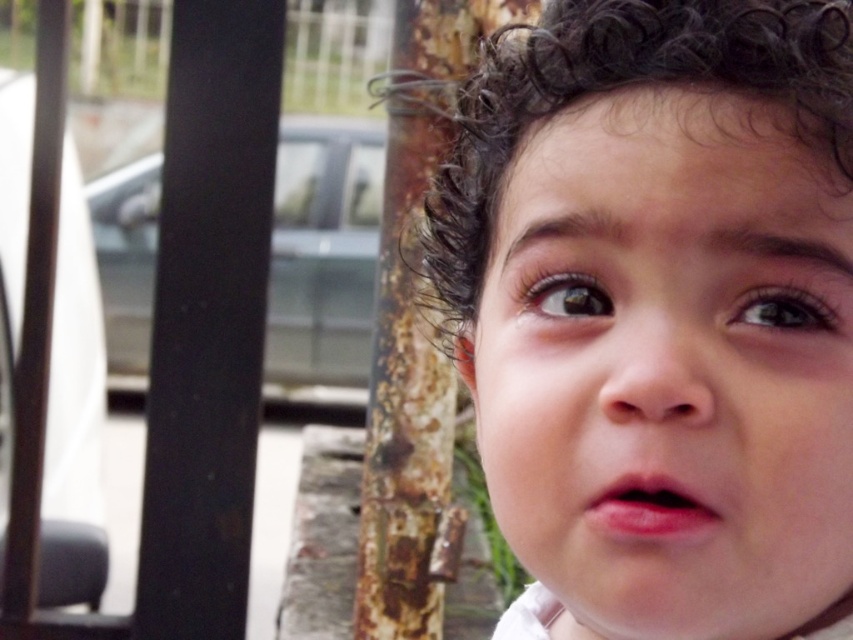
Question: Is smooth skin face at center bigger than brown glossy eye at upper center?

Choices:
 (A) yes
 (B) no

Answer: (A)

Question: Is smooth skin face at center smaller than dark curly hair at center?

Choices:
 (A) no
 (B) yes

Answer: (B)

Question: Which of the following is the closest to the observer?

Choices:
 (A) smooth skin face at center
 (B) dark curly hair at center
 (C) brown glossy eye at upper right
 (D) brown glossy eye at upper center

Answer: (A)

Question: Observing the image, what is the correct spatial positioning of dark curly hair at center in reference to brown glossy eye at upper right?

Choices:
 (A) right
 (B) left

Answer: (B)

Question: Which of the following is the closest to the observer?

Choices:
 (A) brown glossy eye at upper center
 (B) smooth skin face at center
 (C) dark curly hair at center

Answer: (B)

Question: Which of the following is the closest to the observer?

Choices:
 (A) brown glossy eye at upper center
 (B) dark curly hair at center
 (C) smooth skin face at center
 (D) brown glossy eye at upper right

Answer: (C)